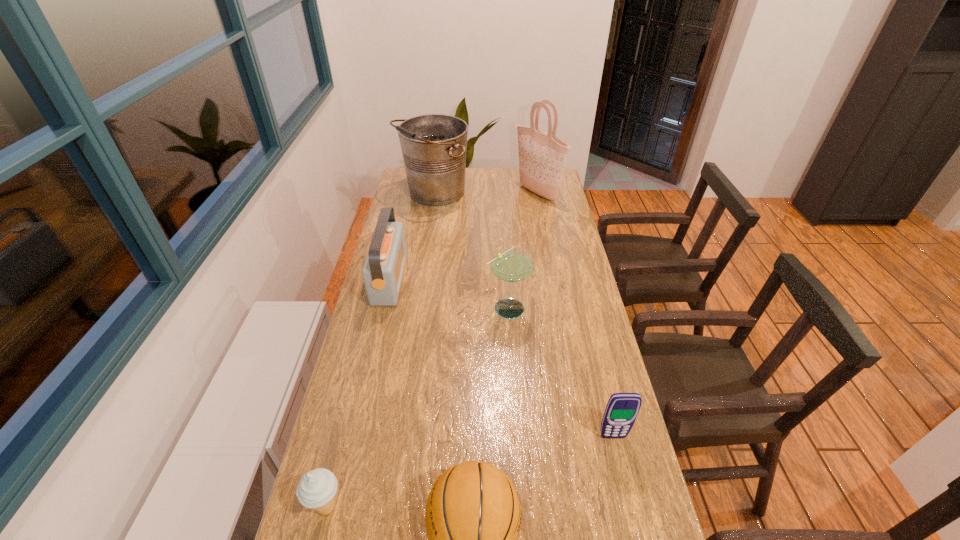
Locate an element on the screen. This screenshot has width=960, height=540. shopping bag is located at coordinates (542, 157).

At what (x,y) coordinates should I click in order to perform the action: click on bucket. Please return your answer as a coordinate pair (x, y). This screenshot has width=960, height=540. Looking at the image, I should click on (433, 146).

Locate an element on the screen. The height and width of the screenshot is (540, 960). radio receiver is located at coordinates (383, 269).

Where is `martini`? This screenshot has height=540, width=960. martini is located at coordinates (510, 264).

Identify the location of the third nearest object. (622, 409).

Find the location of a particular element. The width and height of the screenshot is (960, 540). the shortest object is located at coordinates (317, 488).

At what (x,y) coordinates should I click in order to perform the action: click on free space located on the front of the tallest object. Please return your answer as a coordinate pair (x, y). This screenshot has width=960, height=540. Looking at the image, I should click on (541, 220).

Find the location of a particular element. The image size is (960, 540). free space located 0.280m on the front of the sixth shortest object is located at coordinates (424, 253).

You are a GUI agent. You are given a task and a screenshot of the screen. Output one action in this format:
    pyautogui.click(x=<x>, y=<y>)
    Task: Click on the free space located 0.060m on the front-facing side of the radio receiver
    The height and width of the screenshot is (540, 960).
    Given the screenshot: What is the action you would take?
    pyautogui.click(x=420, y=279)

I want to click on free location located on the left of the martini, so click(x=378, y=307).